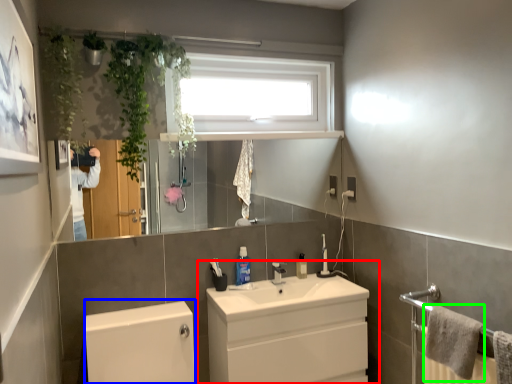
Question: Estimate the real-world distances between objects in this image. Which object is farther from bathroom cabinet (highlighted by a red box), bath (highlighted by a blue box) or bath towel (highlighted by a green box)?

Choices:
 (A) bath
 (B) bath towel

Answer: (B)